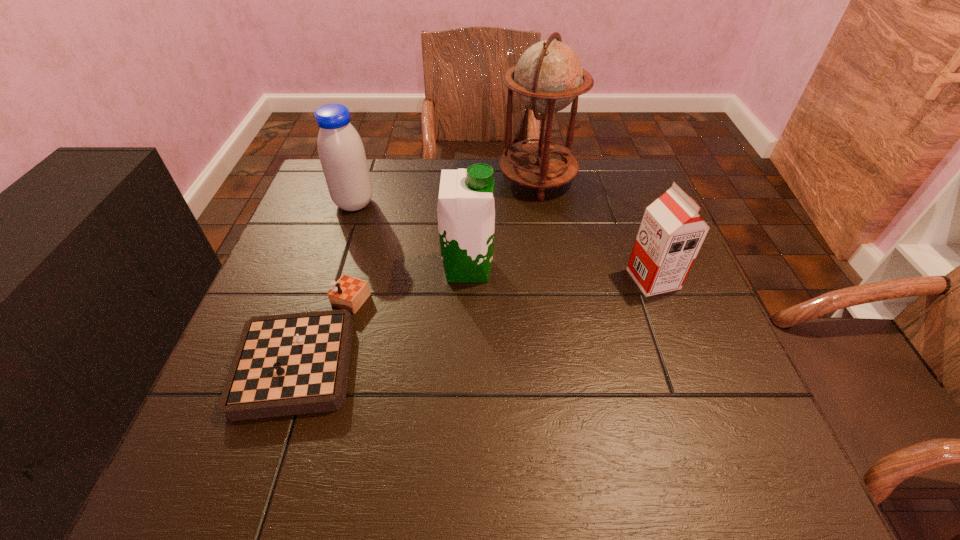
The image size is (960, 540). I want to click on blank space that satisfies the following two spatial constraints: 1. on the surface of the rightmost soya milk; 2. on the right side of the globe, so click(x=553, y=279).

I want to click on vacant space that satisfies the following two spatial constraints: 1. on the back side of the rightmost soya milk; 2. on the surface of the fourth object from left to right, so [615, 179].

This screenshot has height=540, width=960. Find the location of `vacant space that satisfies the following two spatial constraints: 1. on the surface of the fourth object from left to right; 2. on the back side of the rightmost object`. vacant space that satisfies the following two spatial constraints: 1. on the surface of the fourth object from left to right; 2. on the back side of the rightmost object is located at coordinates (553, 279).